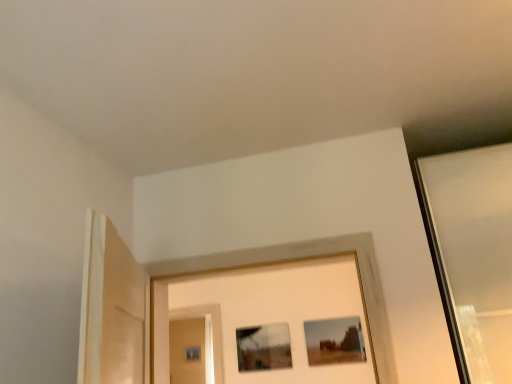
Question: Is matte glass picture frame at center, which is counted as the 1th picture frame, starting from the left, far away from matte brown picture frame at center, the 1th picture frame from the right?

Choices:
 (A) no
 (B) yes

Answer: (A)

Question: Can you confirm if matte glass picture frame at center, which is counted as the 1th picture frame, starting from the left, is bigger than matte brown picture frame at center, the 1th picture frame from the right?

Choices:
 (A) yes
 (B) no

Answer: (A)

Question: Is matte glass picture frame at center, which is counted as the 1th picture frame, starting from the left, in contact with matte brown picture frame at center, the 1th picture frame from the right?

Choices:
 (A) yes
 (B) no

Answer: (B)

Question: Considering the relative sizes of matte glass picture frame at center, which appears as the 2th picture frame when viewed from the right, and matte brown picture frame at center, which is counted as the 2th picture frame, starting from the left, in the image provided, is matte glass picture frame at center, which appears as the 2th picture frame when viewed from the right, thinner than matte brown picture frame at center, which is counted as the 2th picture frame, starting from the left,?

Choices:
 (A) no
 (B) yes

Answer: (A)

Question: From the image's perspective, is matte glass picture frame at center, which is counted as the 1th picture frame, starting from the left, beneath matte brown picture frame at center, the 1th picture frame from the right?

Choices:
 (A) yes
 (B) no

Answer: (A)

Question: Is matte glass picture frame at center, which is counted as the 1th picture frame, starting from the left, looking in the opposite direction of matte brown picture frame at center, the 1th picture frame from the right?

Choices:
 (A) yes
 (B) no

Answer: (B)

Question: Considering the relative sizes of matte glass picture frame at center, which appears as the 2th picture frame when viewed from the right, and matte glass screen door at center in the image provided, is matte glass picture frame at center, which appears as the 2th picture frame when viewed from the right, bigger than matte glass screen door at center?

Choices:
 (A) yes
 (B) no

Answer: (B)

Question: Considering the relative positions of matte glass picture frame at center, which appears as the 2th picture frame when viewed from the right, and matte glass screen door at center in the image provided, is matte glass picture frame at center, which appears as the 2th picture frame when viewed from the right, to the left of matte glass screen door at center from the viewer's perspective?

Choices:
 (A) yes
 (B) no

Answer: (B)

Question: From a real-world perspective, is matte glass picture frame at center, which is counted as the 1th picture frame, starting from the left, on matte glass screen door at center?

Choices:
 (A) no
 (B) yes

Answer: (B)

Question: Are matte glass picture frame at center, which is counted as the 1th picture frame, starting from the left, and matte glass screen door at center located far from each other?

Choices:
 (A) yes
 (B) no

Answer: (B)

Question: Does matte glass picture frame at center, which is counted as the 1th picture frame, starting from the left, lie in front of matte glass screen door at center?

Choices:
 (A) no
 (B) yes

Answer: (B)

Question: Is matte glass picture frame at center, which is counted as the 1th picture frame, starting from the left, taller than matte glass screen door at center?

Choices:
 (A) yes
 (B) no

Answer: (B)

Question: Is matte brown picture frame at center, which is counted as the 2th picture frame, starting from the left, turned away from matte glass screen door at center?

Choices:
 (A) yes
 (B) no

Answer: (B)